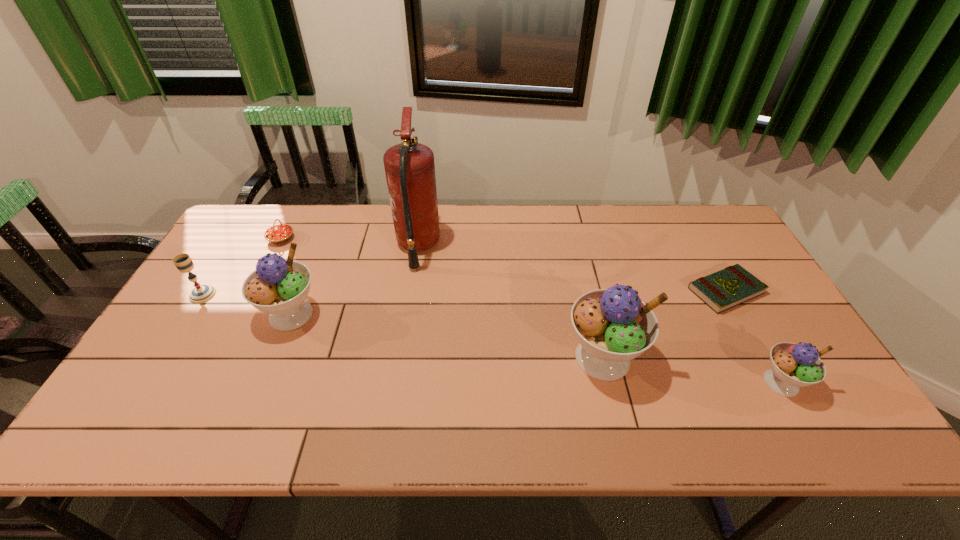
Where is `vacant area that lies between the second icecream from right to left and the rightmost icecream`? The image size is (960, 540). vacant area that lies between the second icecream from right to left and the rightmost icecream is located at coordinates (692, 370).

Where is `free space between the leftmost object and the second object from left to right`? The image size is (960, 540). free space between the leftmost object and the second object from left to right is located at coordinates (242, 267).

Image resolution: width=960 pixels, height=540 pixels. Find the location of `blank region between the second icecream from left to right and the fourth object from right to left`. blank region between the second icecream from left to right and the fourth object from right to left is located at coordinates (511, 302).

This screenshot has height=540, width=960. What are the coordinates of `free spot between the rightmost icecream and the third object from right to left` in the screenshot? It's located at (692, 370).

I want to click on empty location between the book and the leftmost object, so click(x=465, y=293).

Image resolution: width=960 pixels, height=540 pixels. What are the coordinates of `vacant space that's between the rightmost icecream and the third object from right to left` in the screenshot? It's located at (692, 370).

Where is `free space between the book and the fifth object from left to right`? free space between the book and the fifth object from left to right is located at coordinates (664, 325).

Locate an element on the screen. This screenshot has height=540, width=960. vacant space that's between the second icecream from left to right and the second object from left to right is located at coordinates (442, 298).

You are a GUI agent. You are given a task and a screenshot of the screen. Output one action in this format:
    pyautogui.click(x=<x>, y=<y>)
    Task: Click on the object that stands as the fourth closest to the sixth tallest object
    
    Given the screenshot: What is the action you would take?
    pyautogui.click(x=613, y=326)

Identify the location of object that ranks as the closest to the fire extinguisher. This screenshot has height=540, width=960. (278, 287).